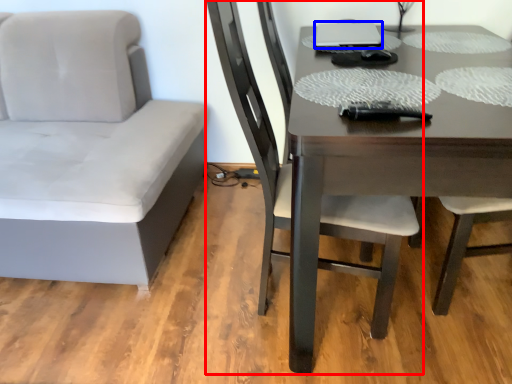
Question: Which point is further to the camera, chair (highlighted by a red box) or laptop (highlighted by a blue box)?

Choices:
 (A) chair
 (B) laptop

Answer: (B)